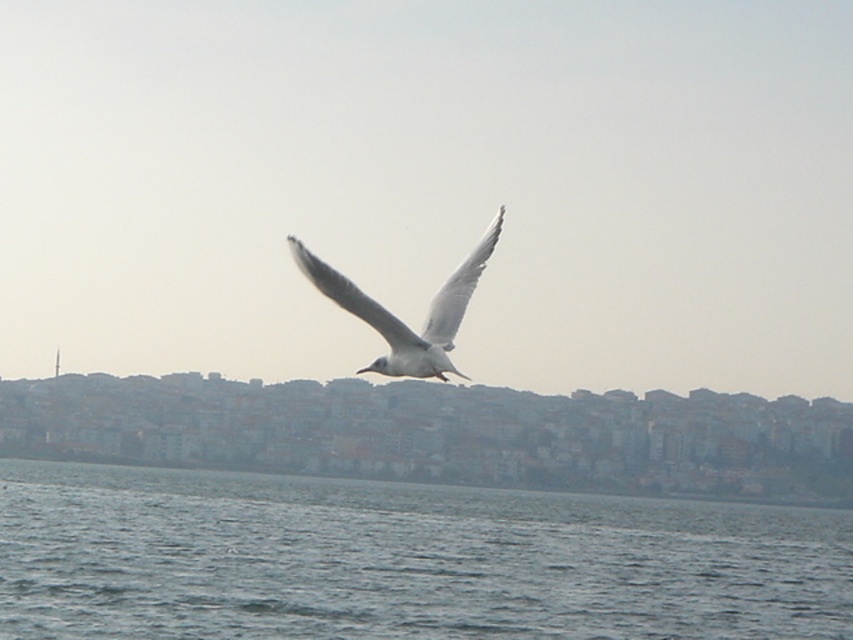
Question: Is gray water at lower center smaller than white feathered bird at center?

Choices:
 (A) no
 (B) yes

Answer: (A)

Question: Which point is farther to the camera?

Choices:
 (A) (218, 541)
 (B) (323, 282)

Answer: (A)

Question: Which of the following is the closest to the observer?

Choices:
 (A) white feathered bird at center
 (B) gray water at lower center

Answer: (A)

Question: Where is gray water at lower center located in relation to white feathered bird at center in the image?

Choices:
 (A) above
 (B) below

Answer: (B)

Question: Which point is farther from the camera taking this photo?

Choices:
 (A) (444, 348)
 (B) (624, 589)

Answer: (B)

Question: Is gray water at lower center positioned before white feathered bird at center?

Choices:
 (A) no
 (B) yes

Answer: (A)